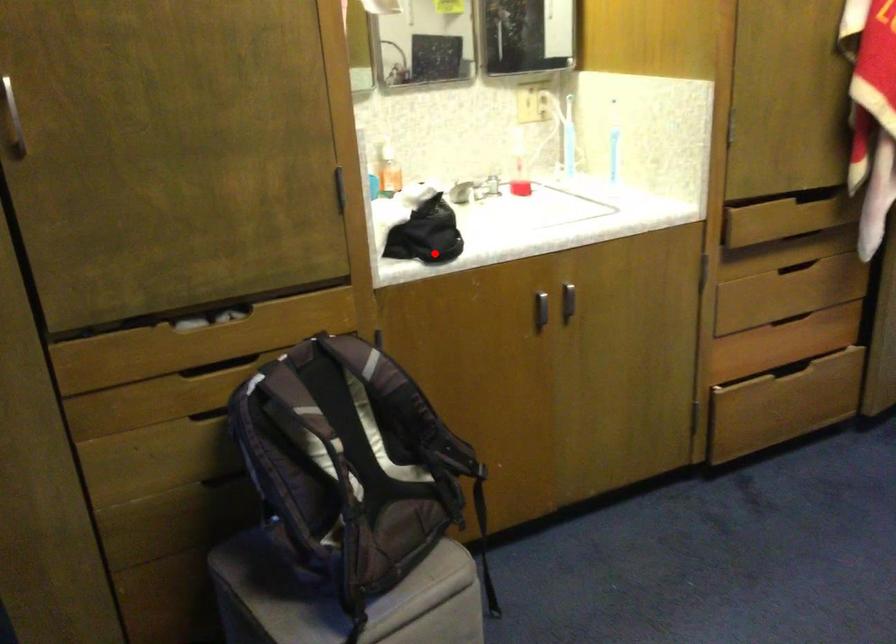
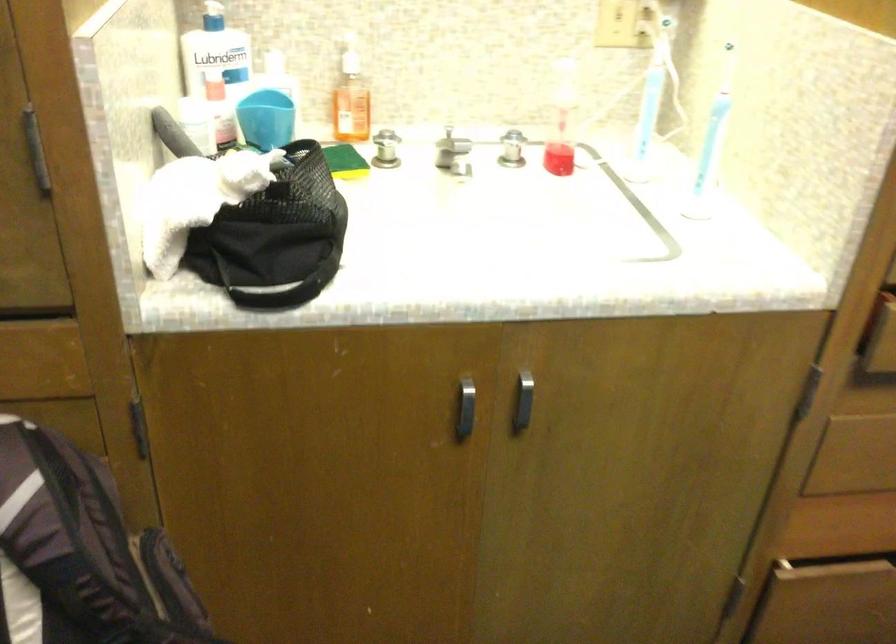
Question: I am providing you with two images of the same scene from different viewpoints. In image1, a red point is highlighted. Considering the same 3D point in image2, which of the following is correct?

Choices:
 (A) It is closer
 (B) It is farther

Answer: (A)